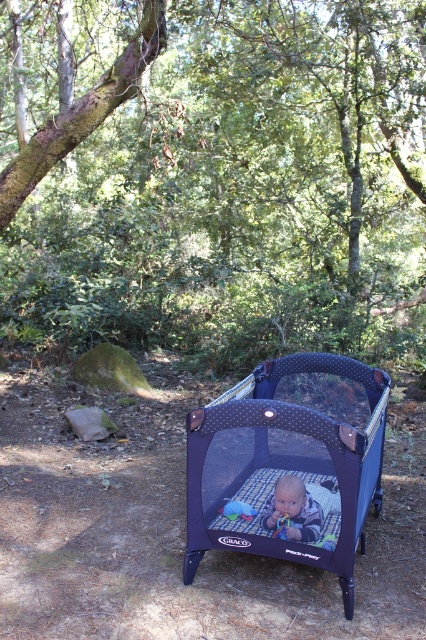
Question: Does green mossy tree trunk at upper left appear on the left side of blue fabric baby at center?

Choices:
 (A) yes
 (B) no

Answer: (A)

Question: Considering the relative positions of green mossy tree trunk at upper left and blue fabric baby at center in the image provided, where is green mossy tree trunk at upper left located with respect to blue fabric baby at center?

Choices:
 (A) below
 (B) above

Answer: (B)

Question: Is green mossy tree trunk at upper left thinner than dark blue fabric playpen at center?

Choices:
 (A) no
 (B) yes

Answer: (B)

Question: Which object is positioned farthest from the blue fabric baby at center?

Choices:
 (A) dark blue fabric playpen at center
 (B) green mossy tree trunk at upper left

Answer: (B)

Question: Which point is closer to the camera?

Choices:
 (A) (278, 499)
 (B) (382, 412)

Answer: (A)

Question: Among these objects, which one is farthest from the camera?

Choices:
 (A) green mossy tree trunk at upper left
 (B) blue fabric baby at center
 (C) dark blue fabric playpen at center

Answer: (A)